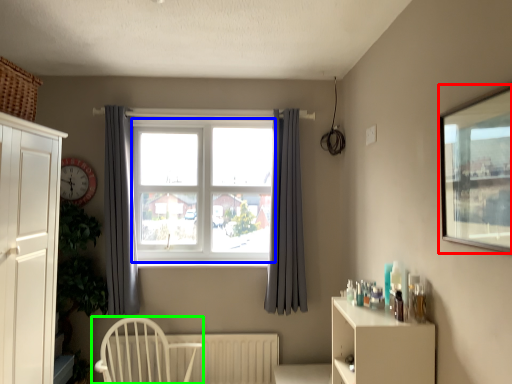
Question: Which is nearer to the window screen (highlighted by a red box)? bay window (highlighted by a blue box) or chair (highlighted by a green box).

Choices:
 (A) bay window
 (B) chair

Answer: (A)